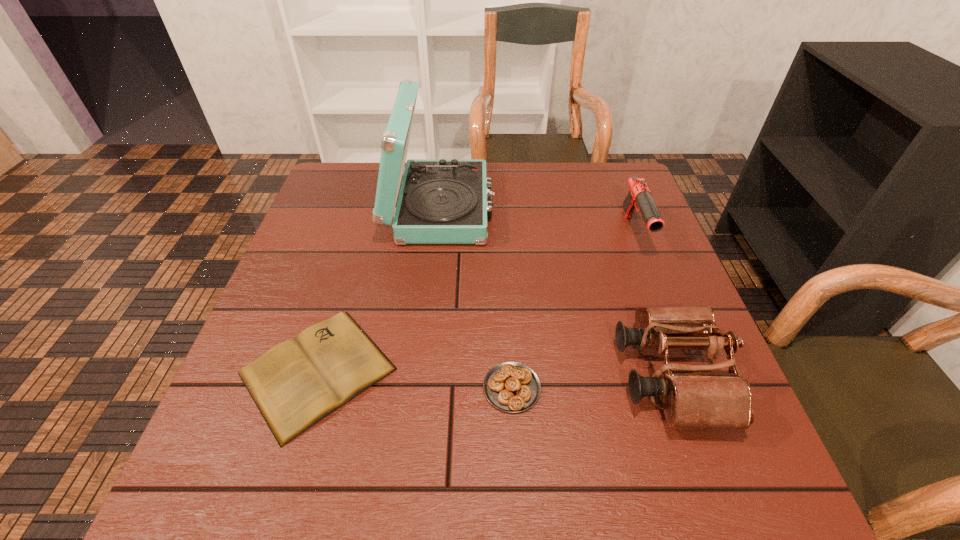
The width and height of the screenshot is (960, 540). Find the location of `empty space between the binoculars and the pastry`. empty space between the binoculars and the pastry is located at coordinates [590, 382].

Find the location of a particular element. This screenshot has height=540, width=960. vacant point located between the fourth tallest object and the binoculars is located at coordinates (590, 382).

Where is `vacant space that's between the tallest object and the pastry`? This screenshot has height=540, width=960. vacant space that's between the tallest object and the pastry is located at coordinates (476, 298).

You are a GUI agent. You are given a task and a screenshot of the screen. Output one action in this format:
    pyautogui.click(x=<x>, y=<y>)
    Task: Click on the free spot between the record player and the binoculars
    
    Given the screenshot: What is the action you would take?
    point(555,292)

Identify the location of object that is the third closest to the gun. (513, 387).

Find the location of `object that is the second nearest to the fourth tallest object`. object that is the second nearest to the fourth tallest object is located at coordinates (295, 384).

At what (x,y) coordinates should I click in order to perform the action: click on free space that satisfies the following two spatial constraints: 1. on the face side of the record player; 2. on the left side of the pastry. Please return your answer as a coordinate pair (x, y). Looking at the image, I should click on (420, 388).

Find the location of a particular element. The width and height of the screenshot is (960, 540). free region that satisfies the following two spatial constraints: 1. through the eyepieces of the binoculars; 2. on the front side of the pastry is located at coordinates (674, 388).